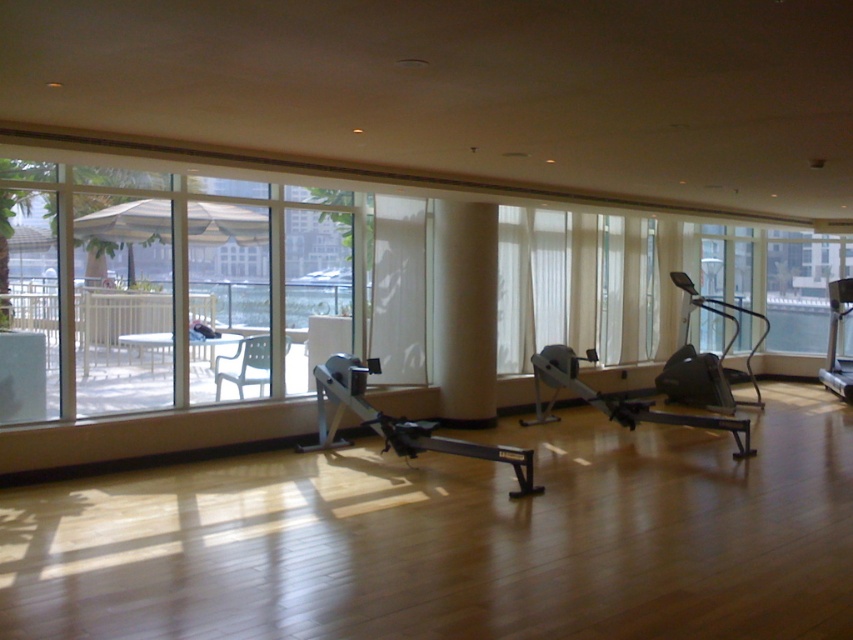
You are a fitness instructor setting up a workout station in the fitness area. You need to place a 2.5 meter long yoga mat between the silver metallic rowing machine at center and the matte black rowing machine at center. Will the yoga mat fit between them without overlapping the machines?

The distance between the silver metallic rowing machine at center and the matte black rowing machine at center is 2.40 meters. Since the yoga mat is 2.5 meters long, it will not fit between them without overlapping the machines.

Looking at this image, you are standing in the fitness area and want to reach the point marked at coordinates (358, 417). Considering the three exercise machines in front of you, which one is closest to this point?

The point marked at coordinates (358, 417) is 26.55 feet away from the viewer, so the closest exercise machine would depend on their distances. However, since the exact positions of the machines aren

You are standing at the entrance of the fitness area and see two points marked in the image. Which point is closer to you, point [387,221] or point [834,291]?

Point [387,221] is in front of point [834,291], so it is closer to you.